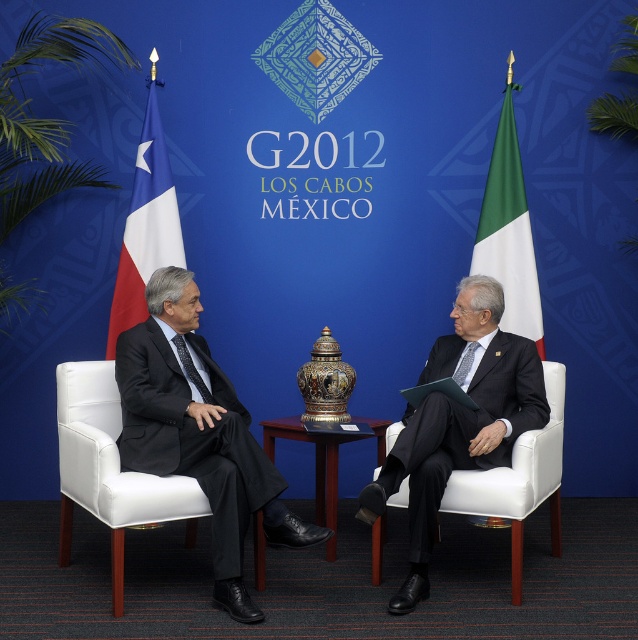
Question: Which is nearer to the tricolor fabric flag at left?

Choices:
 (A) white leather chair at left
 (B) shiny metallic table at center
 (C) dark gray suit at left
 (D) white leather chair at center

Answer: (A)

Question: Is white leather chair at left wider than white leather chair at center?

Choices:
 (A) yes
 (B) no

Answer: (B)

Question: Which object is the closest to the dark gray suit at left?

Choices:
 (A) tricolor fabric flag at left
 (B) white leather chair at center
 (C) white leather chair at left

Answer: (C)

Question: Is white leather chair at center to the left of green fabric flag at right from the viewer's perspective?

Choices:
 (A) yes
 (B) no

Answer: (A)

Question: Which of the following is the closest to the observer?

Choices:
 (A) (551, 376)
 (B) (63, 513)

Answer: (B)

Question: Can you confirm if white leather chair at left is positioned below white leather chair at center?

Choices:
 (A) no
 (B) yes

Answer: (A)